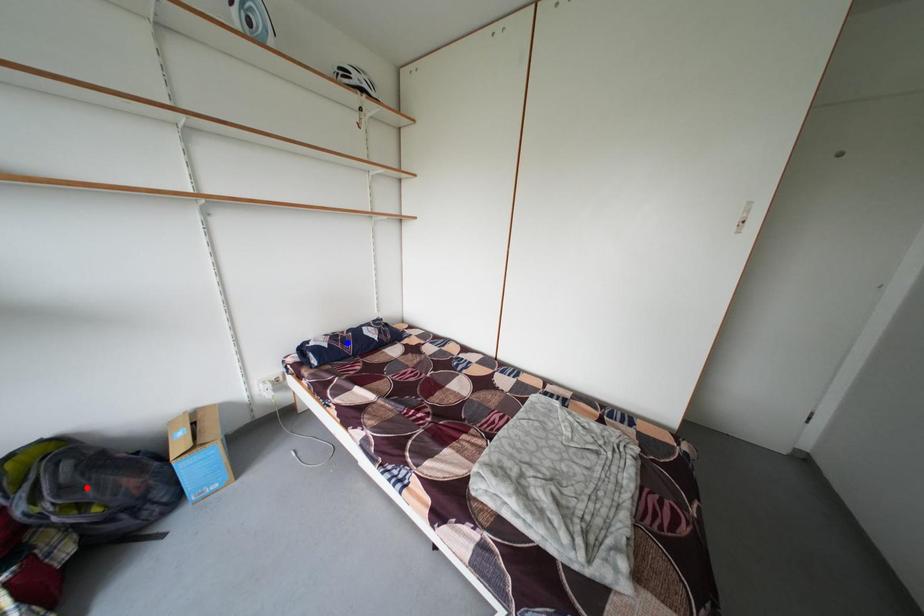
Question: In the image, two points are highlighted. Which point is nearer to the camera? Reply with the corresponding letter.

Choices:
 (A) blue point
 (B) red point

Answer: (B)